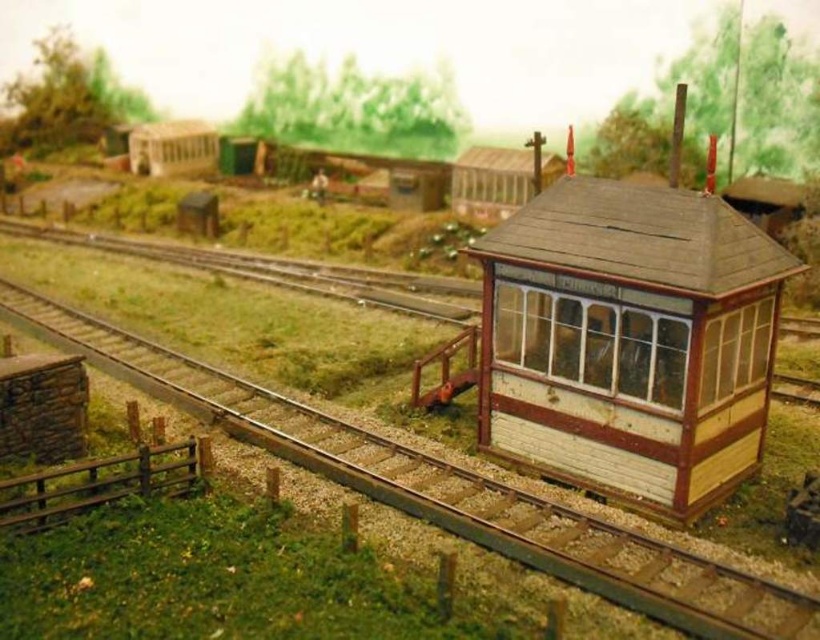
Does wooden signal box at right come in front of brown wooden train track at center?

No.

Which is in front, point (599, 360) or point (616, 545)?

Point (616, 545) is more forward.

Which is in front, point (493, 305) or point (713, 625)?

Point (713, 625) is more forward.

Locate an element on the screen. wooden signal box at right is located at coordinates (623, 339).